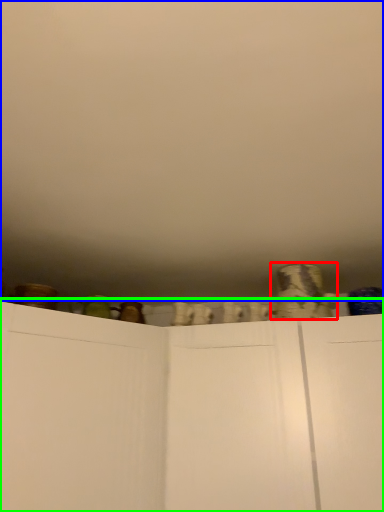
Question: Based on their relative distances, which object is farther from pottery (highlighted by a red box)? Choose from backdrop (highlighted by a blue box) and cupboard (highlighted by a green box).

Choices:
 (A) backdrop
 (B) cupboard

Answer: (A)